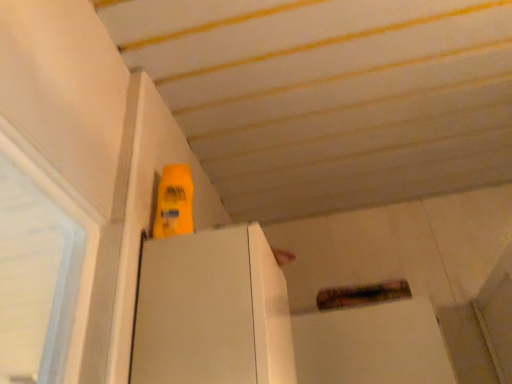
Find the location of a particular element. The height and width of the screenshot is (384, 512). white matte refrigerator at upper left is located at coordinates (212, 311).

Describe the element at coordinates (212, 311) in the screenshot. I see `white matte refrigerator at upper left` at that location.

This screenshot has width=512, height=384. I want to click on white matte refrigerator at upper left, so click(x=212, y=311).